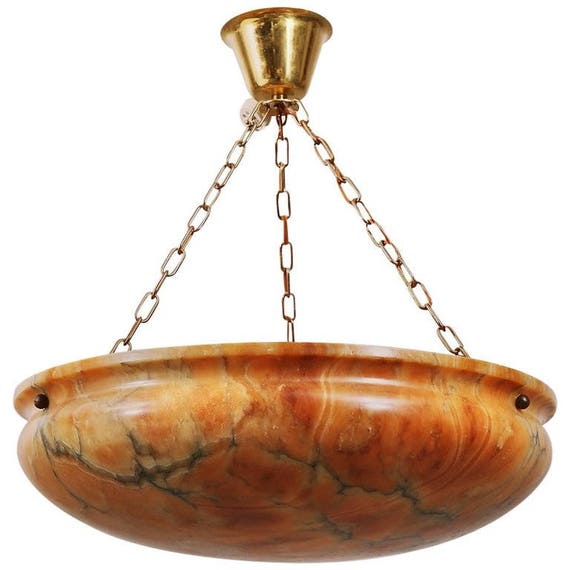
Identify the location of dark marble line on right side of planter bowl. The image size is (570, 570). (409, 490), (349, 475), (306, 459), (272, 451).